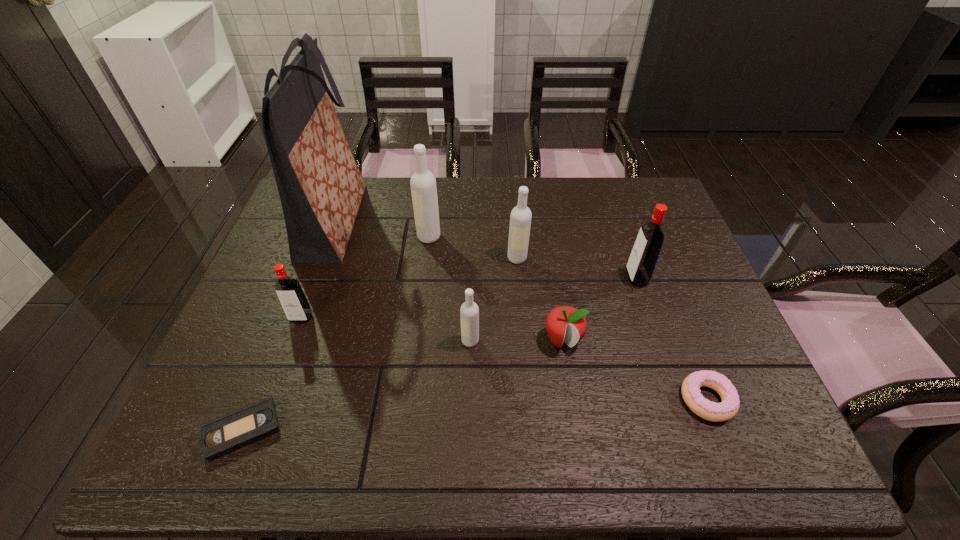
Where is `shopping bag that is at the left edge`? Image resolution: width=960 pixels, height=540 pixels. shopping bag that is at the left edge is located at coordinates [320, 186].

At what (x,y) coordinates should I click in order to perform the action: click on vodka at the left edge. Please return your answer as a coordinate pair (x, y). Looking at the image, I should click on (291, 296).

In order to click on videotape that is at the left edge in this screenshot , I will do `click(230, 432)`.

Where is `vodka positioned at the right edge`? This screenshot has height=540, width=960. vodka positioned at the right edge is located at coordinates (642, 261).

Where is `doughnut at the right edge`? doughnut at the right edge is located at coordinates (729, 406).

At what (x,y) coordinates should I click in order to perform the action: click on object that is at the far left corner. Please return your answer as a coordinate pair (x, y). Looking at the image, I should click on (320, 186).

I want to click on object located at the near left corner, so click(230, 432).

You are a GUI agent. You are given a task and a screenshot of the screen. Output one action in this format:
    pyautogui.click(x=<x>, y=<y>)
    Task: Click on the object that is at the near right corner
    This screenshot has height=540, width=960.
    Given the screenshot: What is the action you would take?
    pyautogui.click(x=729, y=406)

Where is `free region at the far edge`? The height and width of the screenshot is (540, 960). free region at the far edge is located at coordinates (574, 208).

At what (x,y) coordinates should I click in order to perform the action: click on vacant space at the near edge. Please return your answer as a coordinate pair (x, y). The height and width of the screenshot is (540, 960). Looking at the image, I should click on (440, 433).